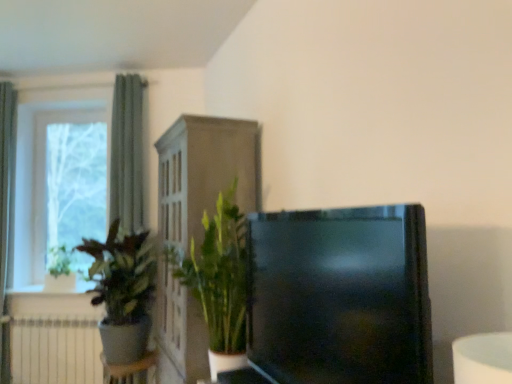
Question: From the image's perspective, is green leafy plant at center, arranged as the first houseplant when viewed from the right, positioned above or below white glossy window sill at lower left?

Choices:
 (A) above
 (B) below

Answer: (A)

Question: From a real-world perspective, relative to white glossy window sill at lower left, is green leafy plant at center, arranged as the first houseplant when viewed from the right, vertically above or below?

Choices:
 (A) above
 (B) below

Answer: (A)

Question: Estimate the real-world distances between objects in this image. Which object is farther from the black glossy tv at center?

Choices:
 (A) green matte plant at left, acting as the 2th houseplant starting from the right
 (B) white glass window at left
 (C) green fabric curtain at left, the first curtain in the left-to-right sequence
 (D) green fabric curtain at left, the 1th curtain when ordered from right to left
 (E) white matte radiator at lower left

Answer: (C)

Question: Estimate the real-world distances between objects in this image. Which object is farther from the green leafy plant at center, arranged as the first houseplant when viewed from the right?

Choices:
 (A) black glossy tv at center
 (B) white glass window at left
 (C) white matte radiator at lower left
 (D) green matte plant at left, placed as the 1th houseplant when sorted from left to right
 (E) green fabric curtain at left, the 2th curtain viewed from the right

Answer: (E)